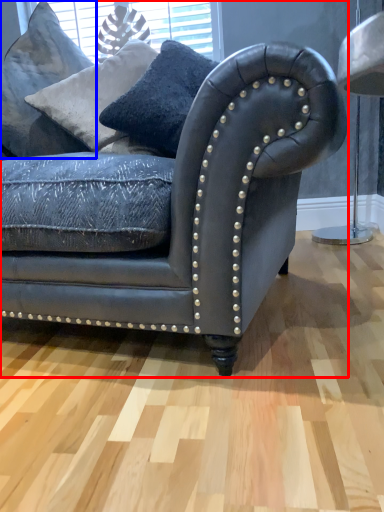
Question: Which object is further to the camera taking this photo, studio couch (highlighted by a red box) or pillow (highlighted by a blue box)?

Choices:
 (A) studio couch
 (B) pillow

Answer: (B)